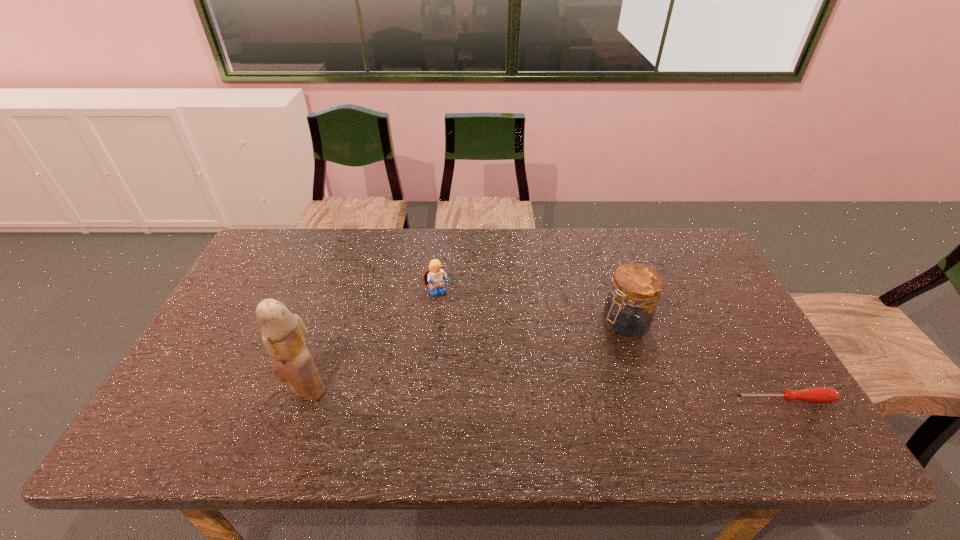
Locate an element on the screen. This screenshot has height=540, width=960. free area in between the second object from right to left and the leftmost object is located at coordinates (465, 357).

Locate an element on the screen. unoccupied area between the second object from right to left and the tallest object is located at coordinates (465, 357).

Where is `blank region between the third object from right to left and the jar`? This screenshot has width=960, height=540. blank region between the third object from right to left and the jar is located at coordinates (531, 309).

The image size is (960, 540). I want to click on vacant area that lies between the screwdriver and the tallest object, so click(543, 394).

The width and height of the screenshot is (960, 540). What are the coordinates of `vacant region between the tallest object and the farthest object` in the screenshot? It's located at (372, 341).

Where is `unoccupied position between the tallest object and the jar`? The width and height of the screenshot is (960, 540). unoccupied position between the tallest object and the jar is located at coordinates (465, 357).

Image resolution: width=960 pixels, height=540 pixels. Identify the location of the second closest object to the jar. (436, 275).

In order to click on object that is the second closest to the figurine in this screenshot , I will do `click(629, 310)`.

The image size is (960, 540). In order to click on vacant point that satisfies the following two spatial constraints: 1. on the front side of the jar; 2. on the left side of the farthest object in this screenshot , I will do `click(435, 325)`.

What are the coordinates of `vacant point that satisfies the following two spatial constraints: 1. on the front side of the jar; 2. on the right side of the second object from left to right` in the screenshot? It's located at (435, 325).